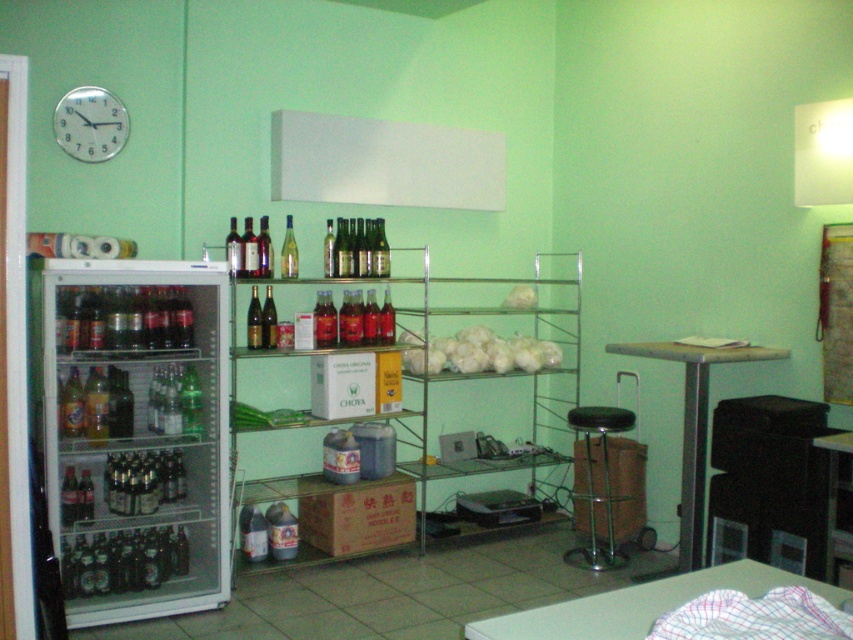
You need to place both the black metal stool at center and the green glass wine at center on a shelf that can only hold items smaller than the stool. Which item should you place first?

The green glass wine at center should be placed first since it is smaller than the black metal stool at center, and the shelf can only hold items smaller than the stool.

You are standing in the storage room and need to reach both points, point (201, 336) and point (364, 260). Which point is closer to you?

Point (201, 336) is closer to the viewer than point (364, 260).